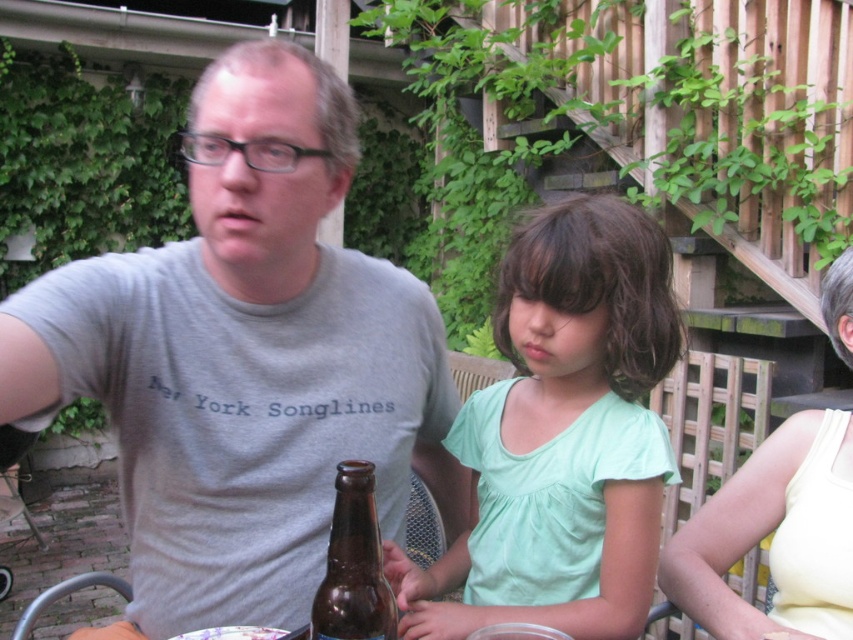
From the picture: You are observing a backyard scene with three people sitting at a table. You notice the gray cotton shirt at upper left and the brown glass bottle at center. Which object is positioned higher in the image?

The gray cotton shirt at upper left is located above the brown glass bottle at center, so it is positioned higher in the image.

You are a photographer trying to capture a group photo of the gray cotton shirt at upper left and the yellow fabric tank top at right. Which clothing item should you focus on first if you want to start from the left side?

The gray cotton shirt at upper left should be focused on first because it is positioned on the left side of the yellow fabric tank top at right.

You are standing in the backyard and want to locate the light green fabric shirt at center. According to the coordinates given, where would you look relative to the image frame?

The light green fabric shirt at center is located at coordinates point 0.681 on the x axis and 0.660 on the y axis relative to the image frame.